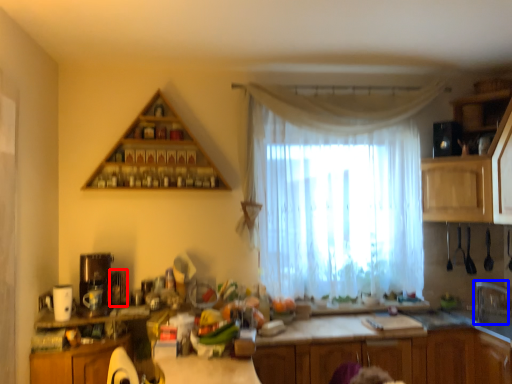
Question: Which object appears closest to the camera in this image, appliance (highlighted by a red box) or faucet (highlighted by a blue box)?

Choices:
 (A) appliance
 (B) faucet

Answer: (B)